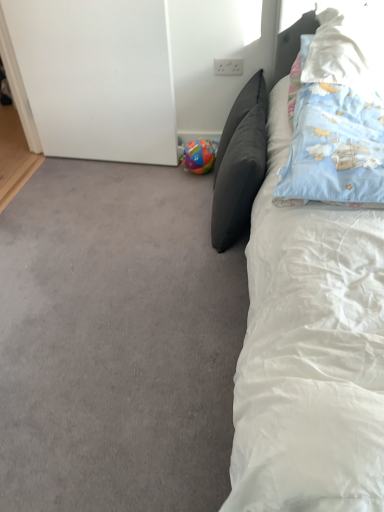
Where is `free space in front of multicolored plastic ball at lower left`? free space in front of multicolored plastic ball at lower left is located at coordinates (186, 182).